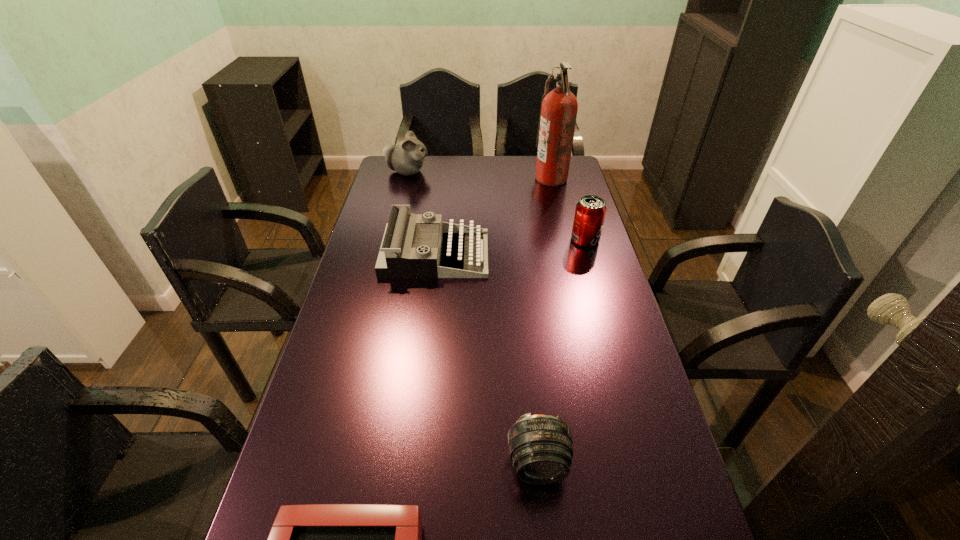
I want to click on fire extinguisher, so click(558, 111).

The image size is (960, 540). In order to click on hamster in this screenshot , I will do `click(407, 158)`.

In order to click on soda can in this screenshot , I will do `click(590, 211)`.

This screenshot has height=540, width=960. I want to click on the second nearest object, so click(x=540, y=446).

The image size is (960, 540). In order to click on the fourth object from left to right in this screenshot , I will do `click(540, 446)`.

I want to click on the farther typewriter, so click(x=397, y=258).

Locate an element on the screen. The image size is (960, 540). vacant space located 0.090m on the front of the fire extinguisher near the operation label is located at coordinates point(514,178).

This screenshot has width=960, height=540. In order to click on free space located 0.160m on the front of the fire extinguisher near the operation label in this screenshot , I will do `click(496, 178)`.

This screenshot has height=540, width=960. What are the coordinates of `vacant space located 0.290m on the front of the fire extinguisher near the operation label` in the screenshot? It's located at [x=466, y=178].

You are a GUI agent. You are given a task and a screenshot of the screen. Output one action in this format:
    pyautogui.click(x=<x>, y=<y>)
    Task: Click on the vacant space located 0.400m on the face of the hamster
    The height and width of the screenshot is (540, 960).
    Given the screenshot: What is the action you would take?
    (x=523, y=172)